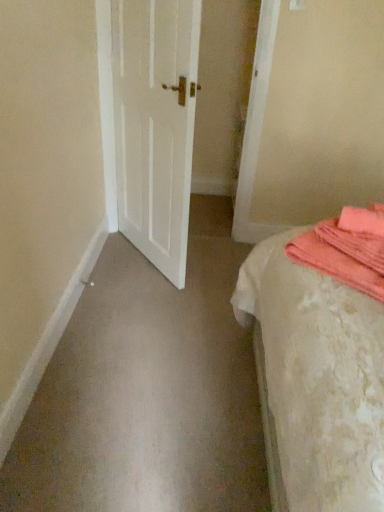
Question: Is coral soft towel at right a part of white textured bed at right?

Choices:
 (A) yes
 (B) no

Answer: (A)

Question: Considering the relative sizes of white textured bed at right and coral soft towel at right in the image provided, is white textured bed at right smaller than coral soft towel at right?

Choices:
 (A) no
 (B) yes

Answer: (A)

Question: Is white textured bed at right closer to camera compared to coral soft towel at right?

Choices:
 (A) no
 (B) yes

Answer: (B)

Question: Would you say white textured bed at right is a long distance from coral soft towel at right?

Choices:
 (A) no
 (B) yes

Answer: (A)

Question: Is white textured bed at right with coral soft towel at right?

Choices:
 (A) no
 (B) yes

Answer: (A)

Question: Can you confirm if white textured bed at right is thinner than coral soft towel at right?

Choices:
 (A) yes
 (B) no

Answer: (B)

Question: Does white matte door at center have a larger size compared to coral soft towel at right?

Choices:
 (A) no
 (B) yes

Answer: (B)

Question: From a real-world perspective, is white matte door at center physically below coral soft towel at right?

Choices:
 (A) no
 (B) yes

Answer: (B)

Question: Is white matte door at center in front of coral soft towel at right?

Choices:
 (A) yes
 (B) no

Answer: (B)

Question: Does white matte door at center have a lesser height compared to coral soft towel at right?

Choices:
 (A) yes
 (B) no

Answer: (B)

Question: Does white matte door at center have a lesser width compared to coral soft towel at right?

Choices:
 (A) no
 (B) yes

Answer: (B)

Question: Can you confirm if white matte door at center is smaller than coral soft towel at right?

Choices:
 (A) yes
 (B) no

Answer: (B)

Question: From a real-world perspective, is white textured bed at right below white matte door at center?

Choices:
 (A) no
 (B) yes

Answer: (B)